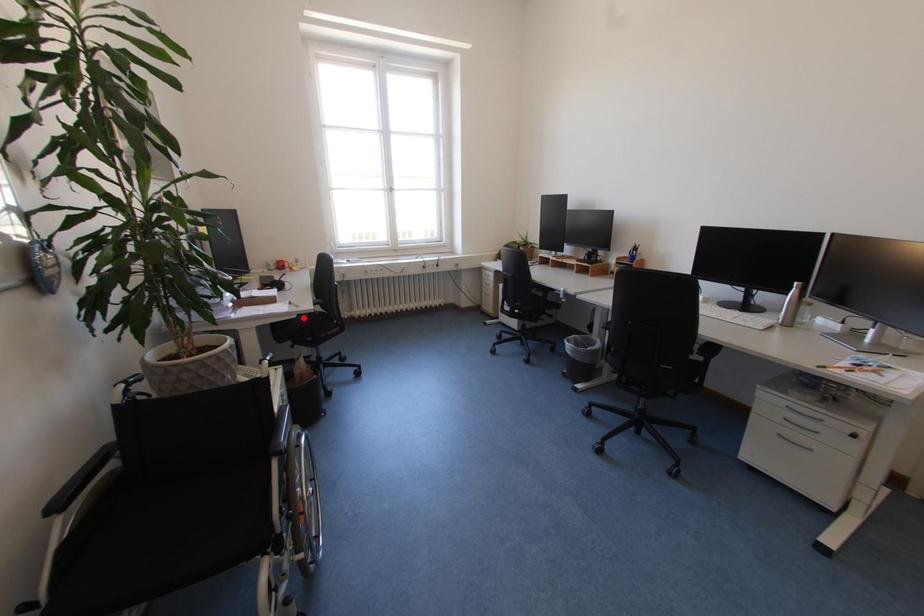
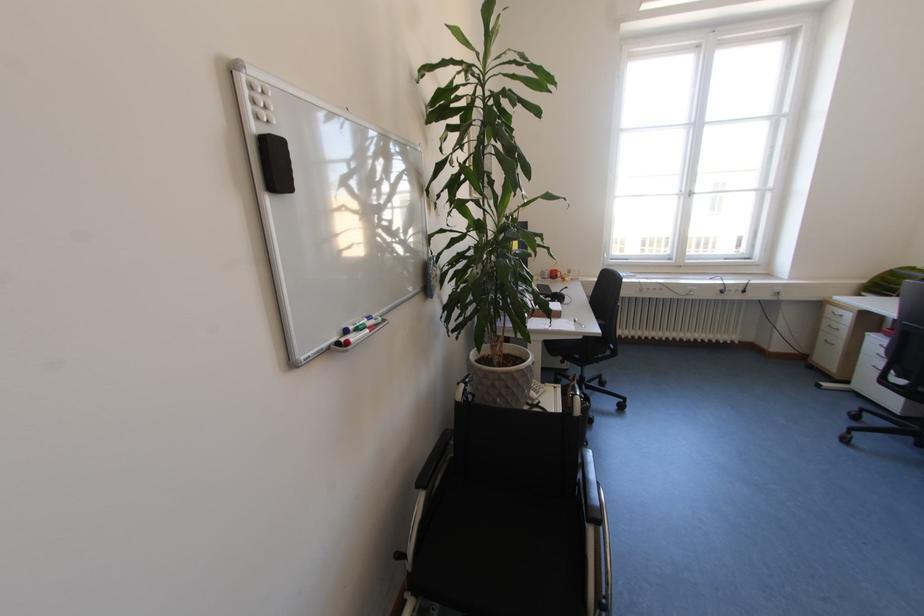
Question: I am providing you with two images of the same scene from different viewpoints. A red point is marked on the first image. Can you still see the location of the red point in image 2?

Choices:
 (A) Yes
 (B) No

Answer: (A)